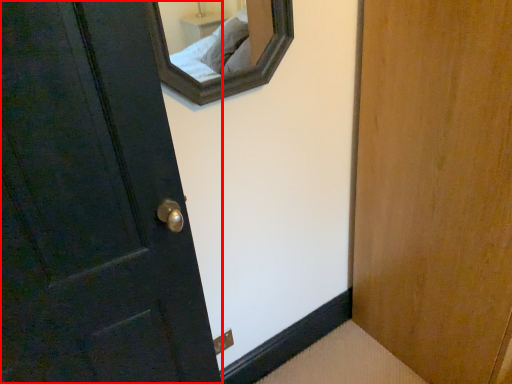
Question: From the image's perspective, where is door (annotated by the red box) located relative to electric outlet?

Choices:
 (A) below
 (B) above

Answer: (B)